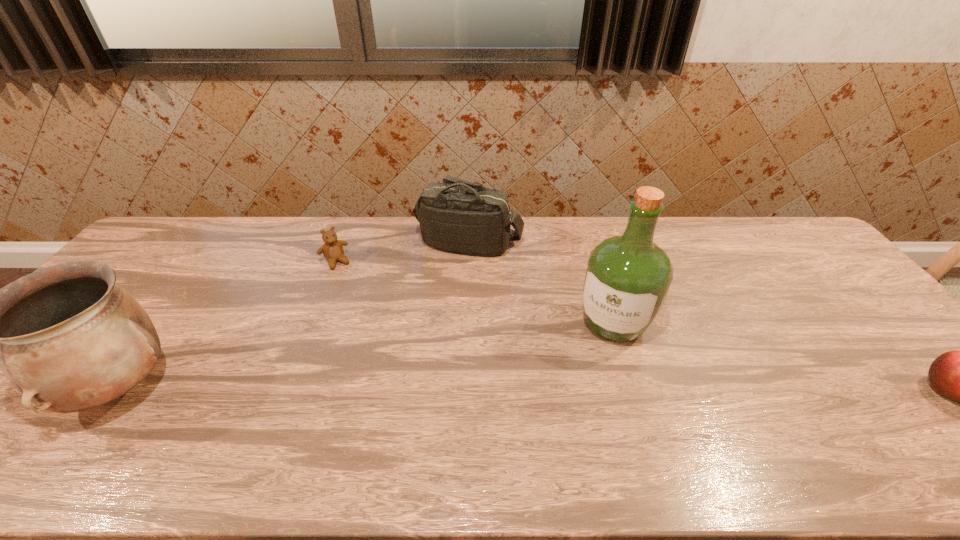
I want to click on free space between the shoulder bag and the fourth object from left to right, so click(541, 284).

What are the coordinates of `object that ranks as the third closest to the rightmost object` in the screenshot? It's located at (332, 249).

This screenshot has width=960, height=540. What are the coordinates of `object that can be found as the second closest to the apple` in the screenshot? It's located at (458, 216).

In order to click on free space that satisfies the following two spatial constraints: 1. on the front side of the liquor; 2. on the left side of the second object from left to right in this screenshot , I will do `click(311, 325)`.